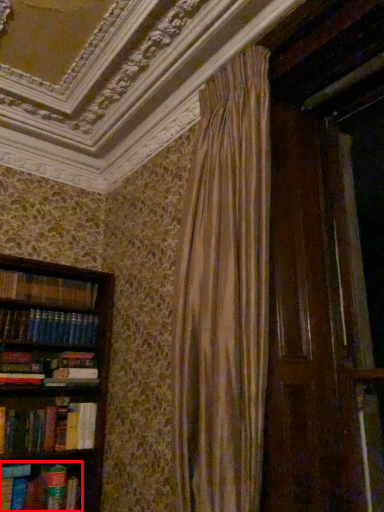
Question: From the image's perspective, where is book (annotated by the red box) located in relation to paperback book in the image?

Choices:
 (A) above
 (B) below

Answer: (A)